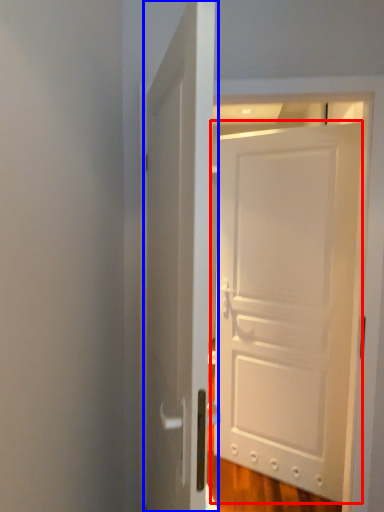
Question: Which object is further to the camera taking this photo, door (highlighted by a red box) or door (highlighted by a blue box)?

Choices:
 (A) door
 (B) door

Answer: (A)